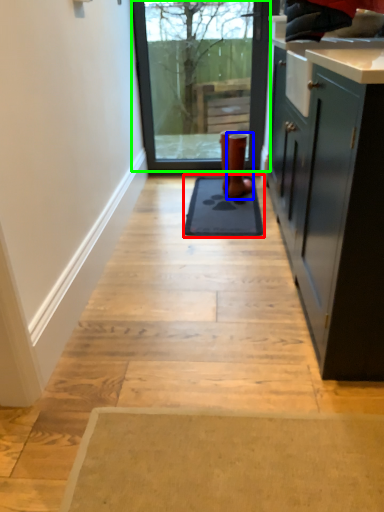
Question: Which is nearer to the mat (highlighted by a red box)? footwear (highlighted by a blue box) or window (highlighted by a green box).

Choices:
 (A) footwear
 (B) window

Answer: (A)